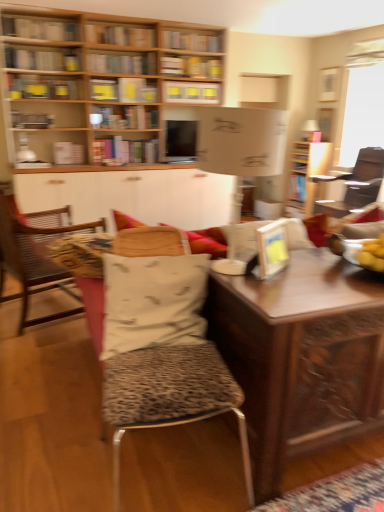
Identify the location of blank space situated above leopard print fabric stool at center (from a real-world perspective). Image resolution: width=384 pixels, height=512 pixels. (176, 362).